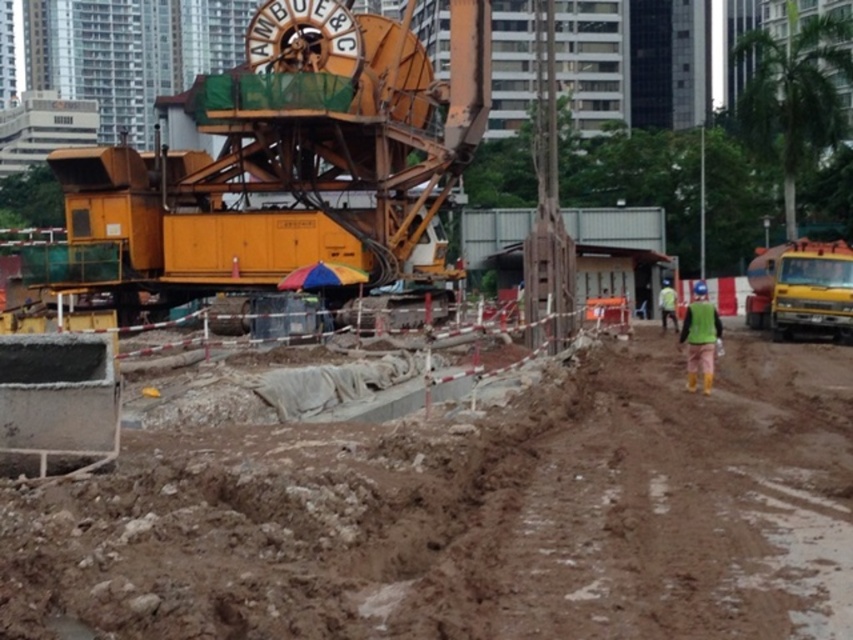
The height and width of the screenshot is (640, 853). Identify the location of brown clay dirt field at lower left. (473, 515).

Which is more to the right, brown clay dirt field at lower left or green fabric construction worker at right?

green fabric construction worker at right

Is point (817, 548) less distant than point (709, 307)?

Yes.

Locate an element on the screen. brown clay dirt field at lower left is located at coordinates (473, 515).